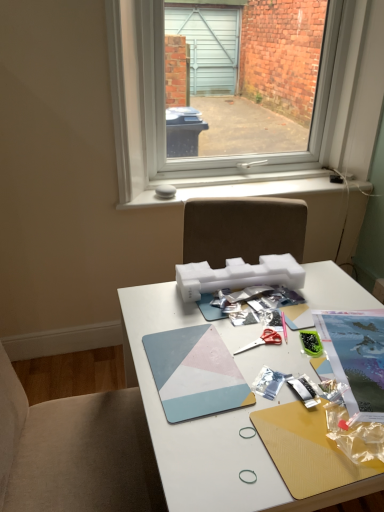
Locate an element on the screen. The width and height of the screenshot is (384, 512). blank space situated above printed paper magazine at center right, the first magazine positioned from the right (from a real-world perspective) is located at coordinates (361, 355).